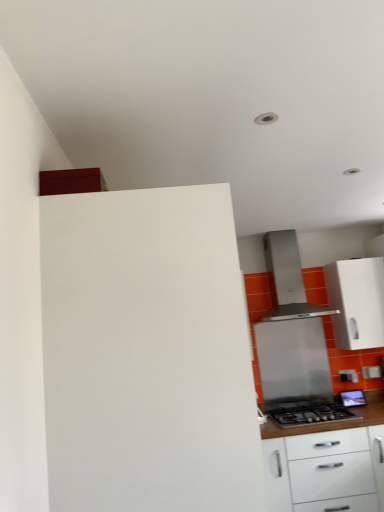
Question: Looking at their shapes, would you say stainless steel range hood at center is wider or thinner than white glossy cabinet at lower right, the second cabinetry when ordered from back to front?

Choices:
 (A) wide
 (B) thin

Answer: (B)

Question: Is stainless steel range hood at center inside the boundaries of white glossy cabinet at lower right, which appears as the 2th cabinetry when viewed from the left, or outside?

Choices:
 (A) outside
 (B) inside

Answer: (A)

Question: Estimate the real-world distances between objects in this image. Which object is closer to the white matte cabinet at upper left, which is the 3th cabinetry in right-to-left order?

Choices:
 (A) stainless steel range hood at center
 (B) white glossy cabinet at lower right, the second cabinetry when ordered from back to front
 (C) white glossy cabinet at right, the first cabinetry positioned from the back
 (D) stainless steel range hood at center
 (E) stainless steel gas stove at lower right

Answer: (B)

Question: Which object is the farthest from the stainless steel range hood at center?

Choices:
 (A) white glossy cabinet at lower right, which appears as the 2th cabinetry when viewed from the front
 (B) stainless steel gas stove at lower right
 (C) white matte cabinet at upper left, which is the 3th cabinetry in right-to-left order
 (D) white glossy cabinet at right, the first cabinetry positioned from the back
 (E) stainless steel range hood at center

Answer: (C)